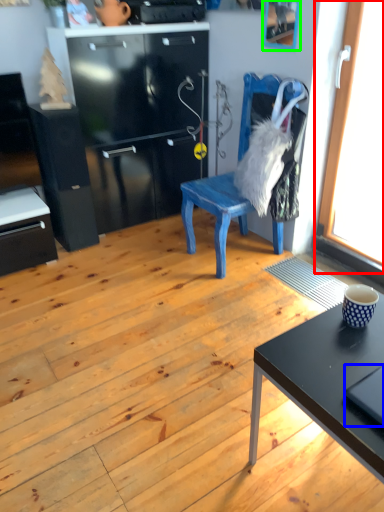
Question: Estimate the real-world distances between objects in this image. Which object is farther from window (highlighted by a red box), laptop (highlighted by a blue box) or picture frame (highlighted by a green box)?

Choices:
 (A) laptop
 (B) picture frame

Answer: (A)